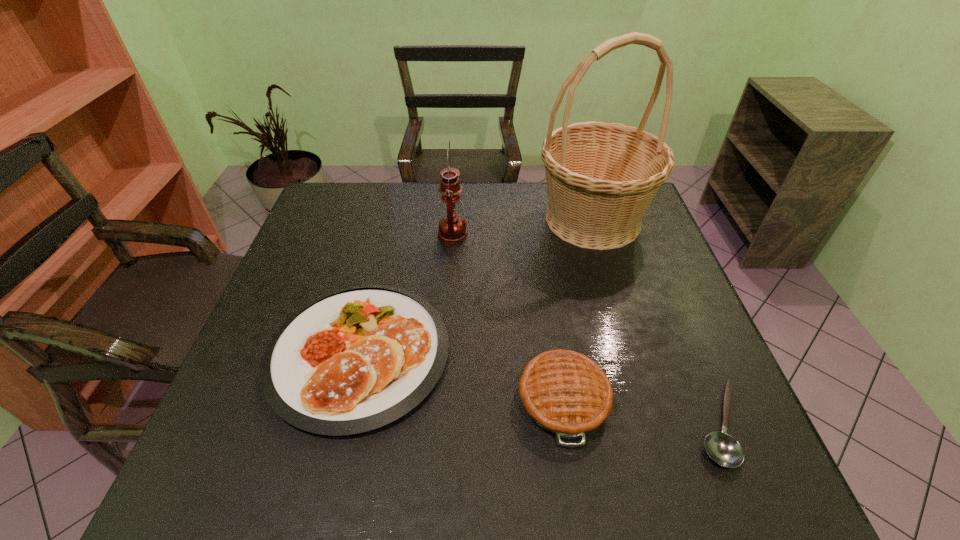
You are a GUI agent. You are given a task and a screenshot of the screen. Output one action in this format:
    pyautogui.click(x=<x>, y=<y>)
    Task: Click on the vacant area between the fourth shortest object and the ladle
    The image size is (960, 540).
    Given the screenshot: What is the action you would take?
    pyautogui.click(x=586, y=329)

At what (x,y) coordinates should I click in order to perform the action: click on vacant region between the third tallest object and the oil lamp. Please return your answer as a coordinate pair (x, y). The width and height of the screenshot is (960, 540). Looking at the image, I should click on (508, 317).

Find the location of a particular element. free space that is in between the second tallest object and the ladle is located at coordinates (586, 329).

At what (x,y) coordinates should I click in order to perform the action: click on vacant point located between the pie and the fourth tallest object. Please return your answer as a coordinate pair (x, y). The height and width of the screenshot is (540, 960). Looking at the image, I should click on (461, 376).

The height and width of the screenshot is (540, 960). I want to click on object that can be found as the closest to the pie, so click(x=356, y=359).

Locate which object is the closest to the ladle. Please provide its 2D coordinates. Your answer should be formatted as a tuple, i.e. [(x, y)], where the tuple contains the x and y coordinates of a point satisfying the conditions above.

[(564, 392)]

In order to click on blank area in the image that satisfies the following two spatial constraints: 1. on the back side of the oil lamp; 2. on the left side of the second shortest object in this screenshot , I will do coord(387,235).